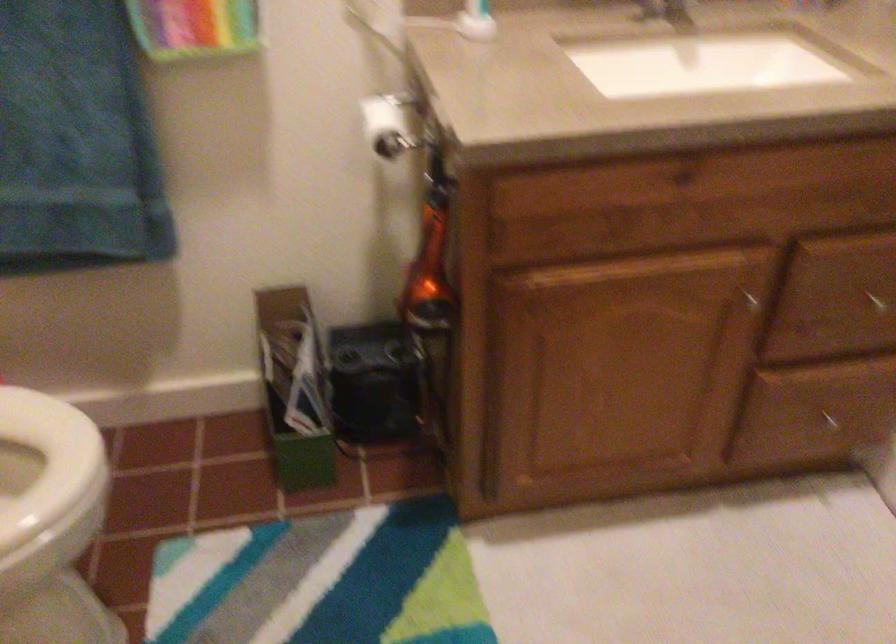
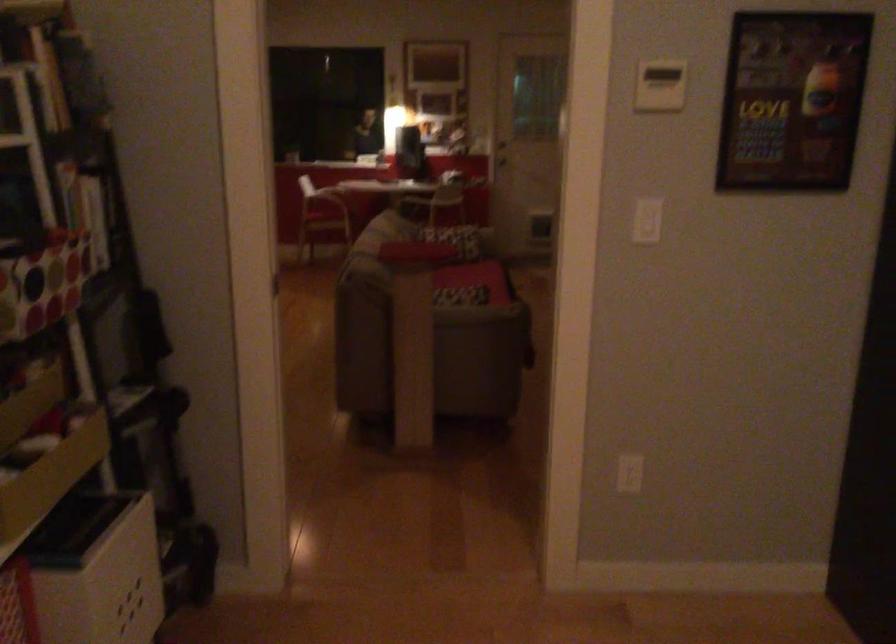
Question: The camera is either moving clockwise (left) or counter-clockwise (right) around the object. The first image is from the beginning of the video and the second image is from the end. Is the camera moving left or right when shooting the video?

Choices:
 (A) Left
 (B) Right

Answer: (A)